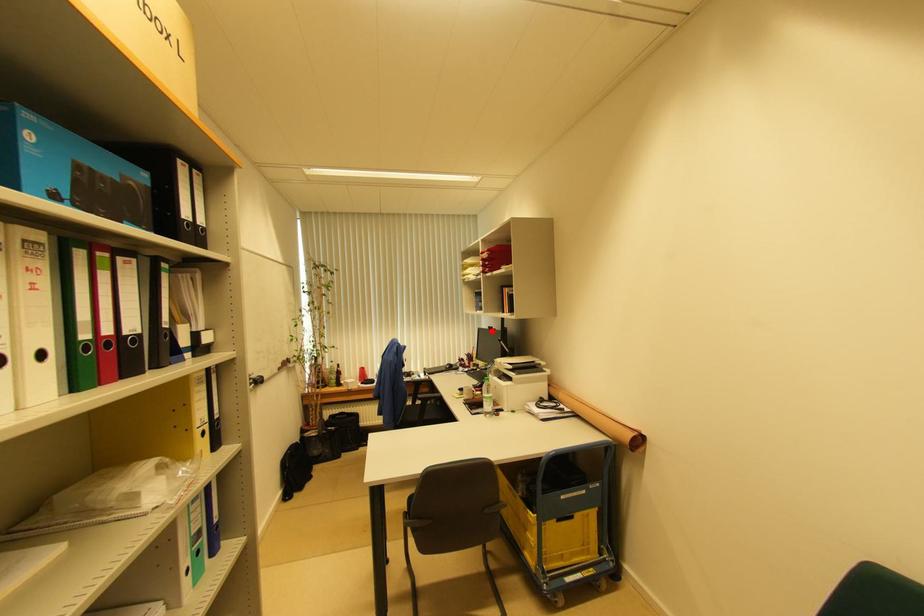
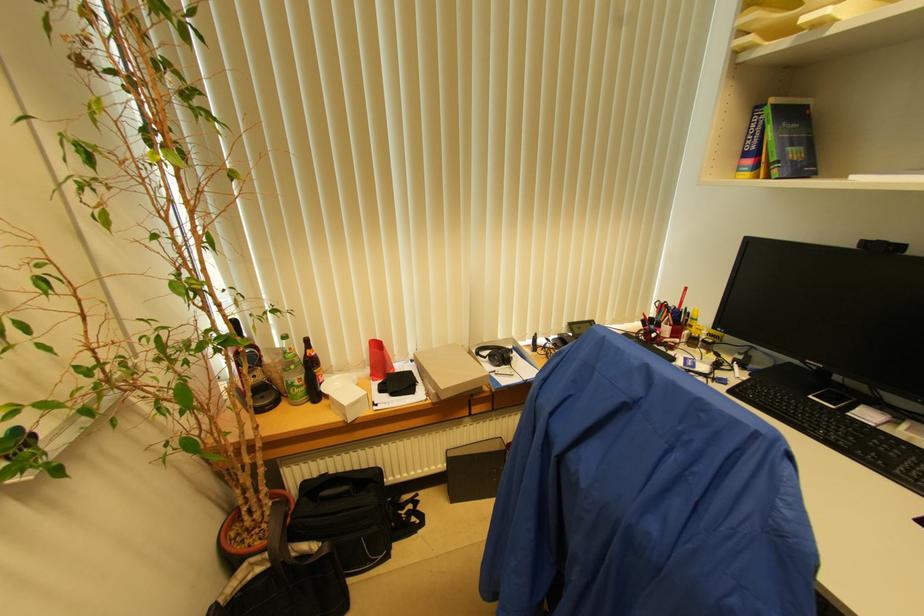
Locate, in the second image, the point that corresponds to the highlighted location in the first image.

(882, 251)